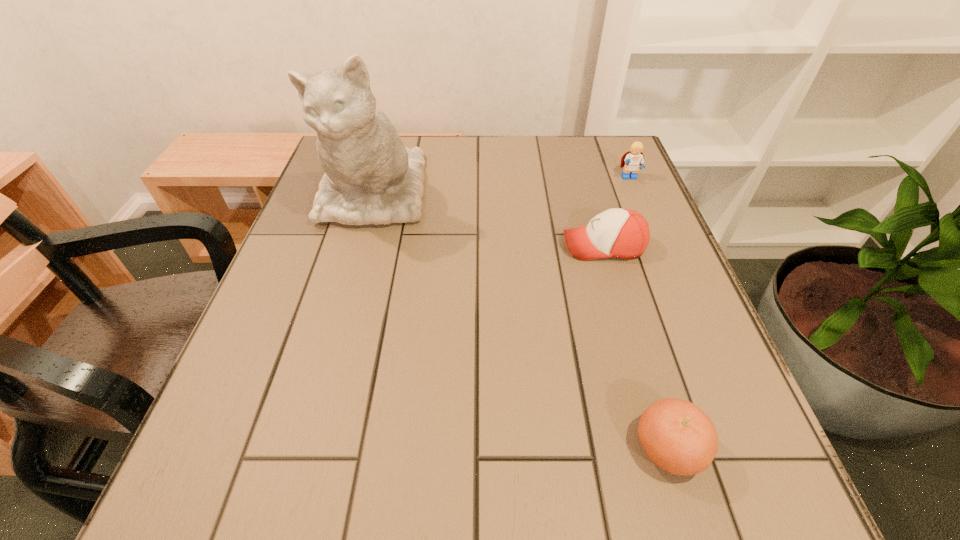
Where is `vacant space located 0.320m on the left of the nearest object`? The image size is (960, 540). vacant space located 0.320m on the left of the nearest object is located at coordinates (418, 448).

You are a GUI agent. You are given a task and a screenshot of the screen. Output one action in this format:
    pyautogui.click(x=<x>, y=<y>)
    Task: Click on the cat present at the far edge
    The image size is (960, 540).
    Given the screenshot: What is the action you would take?
    pyautogui.click(x=370, y=177)

Where is `Lego located at the far edge`? Lego located at the far edge is located at coordinates (633, 160).

Locate an element on the screen. object at the near edge is located at coordinates (677, 436).

Locate an element on the screen. The image size is (960, 540). object present at the left edge is located at coordinates (370, 177).

Where is `Lego that is at the right edge`? Image resolution: width=960 pixels, height=540 pixels. Lego that is at the right edge is located at coordinates (633, 160).

What are the coordinates of `baseball cap that is at the right edge` in the screenshot? It's located at (621, 233).

At what (x,y) coordinates should I click in order to perform the action: click on clementine that is at the right edge. Please return your answer as a coordinate pair (x, y). Looking at the image, I should click on (677, 436).

You are a GUI agent. You are given a task and a screenshot of the screen. Output one action in this format:
    pyautogui.click(x=<x>, y=<y>)
    Task: Click on the object situated at the far left corner
    Image resolution: width=960 pixels, height=540 pixels.
    Given the screenshot: What is the action you would take?
    pyautogui.click(x=370, y=177)

Where is `object located in the far right corner section of the desktop`? The height and width of the screenshot is (540, 960). object located in the far right corner section of the desktop is located at coordinates (633, 160).